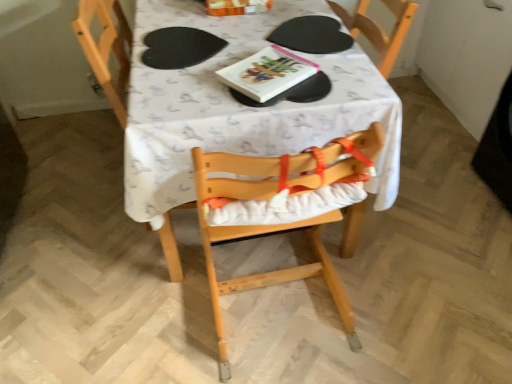
Question: Is hardcover book at center completely or partially inside black matte paper plate at center?

Choices:
 (A) yes
 (B) no

Answer: (B)

Question: Is black matte paper plate at center thinner than hardcover book at center?

Choices:
 (A) no
 (B) yes

Answer: (A)

Question: From the image's perspective, is black matte paper plate at center below hardcover book at center?

Choices:
 (A) yes
 (B) no

Answer: (B)

Question: Is black matte paper plate at center positioned before hardcover book at center?

Choices:
 (A) yes
 (B) no

Answer: (B)

Question: Does black matte paper plate at center have a smaller size compared to hardcover book at center?

Choices:
 (A) yes
 (B) no

Answer: (B)

Question: Looking at their shapes, would you say natural wood highchair at center is wider or thinner than hardcover book at center?

Choices:
 (A) thin
 (B) wide

Answer: (B)

Question: Does point (221, 195) appear closer or farther from the camera than point (285, 69)?

Choices:
 (A) farther
 (B) closer

Answer: (B)

Question: Would you say natural wood highchair at center is to the left or to the right of hardcover book at center in the picture?

Choices:
 (A) left
 (B) right

Answer: (B)

Question: Is natural wood highchair at center in front of or behind hardcover book at center in the image?

Choices:
 (A) front
 (B) behind

Answer: (A)

Question: Considering the positions of black matte paper plate at center and white fabric table at center in the image, is black matte paper plate at center wider or thinner than white fabric table at center?

Choices:
 (A) thin
 (B) wide

Answer: (A)

Question: Is black matte paper plate at center inside the boundaries of white fabric table at center, or outside?

Choices:
 (A) inside
 (B) outside

Answer: (A)

Question: Is point (302, 23) positioned closer to the camera than point (296, 148)?

Choices:
 (A) farther
 (B) closer

Answer: (A)

Question: From the image's perspective, is black matte paper plate at center above or below white fabric table at center?

Choices:
 (A) below
 (B) above

Answer: (B)

Question: Considering the positions of point (390, 152) and point (329, 39), is point (390, 152) closer or farther from the camera than point (329, 39)?

Choices:
 (A) farther
 (B) closer

Answer: (B)

Question: From the image's perspective, is white fabric table at center located above or below black matte paper plate at center?

Choices:
 (A) above
 (B) below

Answer: (B)